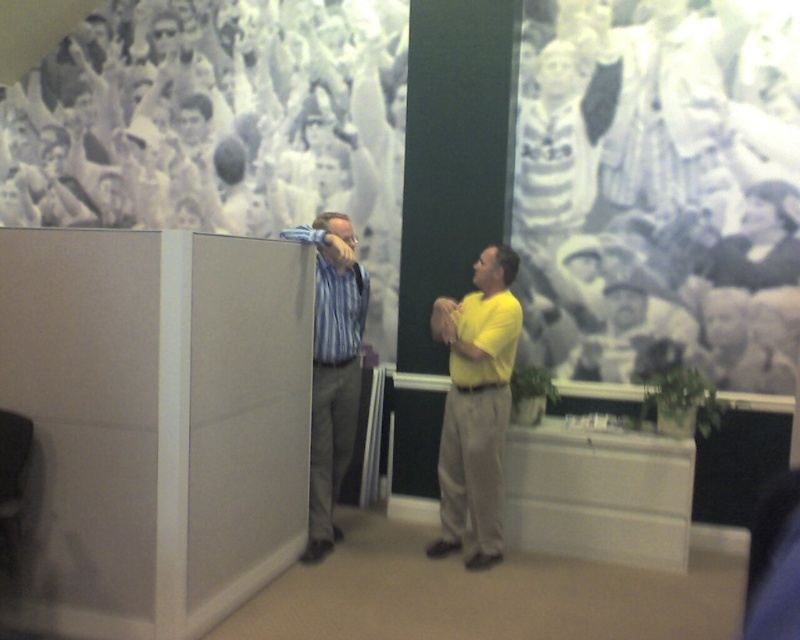
Can you confirm if yellow matte shirt at center is taller than blue striped shirt at left?

Indeed, yellow matte shirt at center has a greater height compared to blue striped shirt at left.

Can you confirm if yellow matte shirt at center is smaller than blue striped shirt at left?

Actually, yellow matte shirt at center might be larger than blue striped shirt at left.

The height and width of the screenshot is (640, 800). Identify the location of yellow matte shirt at center. (476, 404).

Image resolution: width=800 pixels, height=640 pixels. Identify the location of yellow matte shirt at center. (476, 404).

Can you confirm if yellow matte shirt at center is positioned below blue striped dress shirt at left?

Yes.

The width and height of the screenshot is (800, 640). Describe the element at coordinates (476, 404) in the screenshot. I see `yellow matte shirt at center` at that location.

Which is behind, point (448, 349) or point (345, 422)?

The point (448, 349) is more distant.

The height and width of the screenshot is (640, 800). I want to click on yellow matte shirt at center, so click(x=476, y=404).

Is blue striped dress shirt at left bigger than blue striped shirt at left?

Yes, blue striped dress shirt at left is bigger than blue striped shirt at left.

Who is lower down, blue striped dress shirt at left or blue striped shirt at left?

blue striped dress shirt at left is lower down.

Who is more forward, (358, 349) or (316, 278)?

Positioned in front is point (316, 278).

Where is `blue striped dress shirt at left`? blue striped dress shirt at left is located at coordinates click(332, 369).